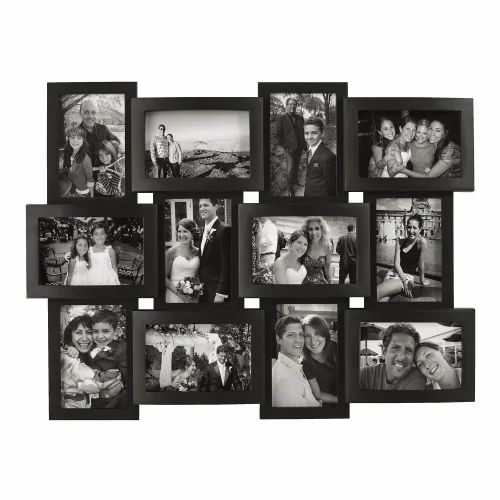
You are a GUI agent. You are given a task and a screenshot of the screen. Output one action in this format:
    pyautogui.click(x=<x>, y=<y>)
    Task: Click on the middle row of photos
    The image size is (500, 500).
    Given the screenshot: What is the action you would take?
    pyautogui.click(x=119, y=245), pyautogui.click(x=192, y=245), pyautogui.click(x=275, y=245), pyautogui.click(x=391, y=244)